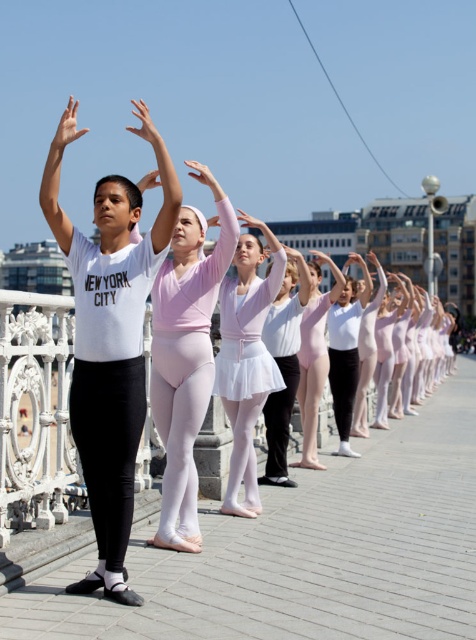
Which of these two, pink satin leotard at center or matte white shirt at upper left, stands shorter?

pink satin leotard at center is shorter.

Is the position of pink satin leotard at center more distant than that of matte white shirt at upper left?

Yes, pink satin leotard at center is behind matte white shirt at upper left.

The image size is (476, 640). I want to click on pink satin leotard at center, so click(186, 356).

Which of these two, white matte t-shirt at center or matte white shirt at upper left, stands shorter?

matte white shirt at upper left

In the scene shown: Can you confirm if white matte t-shirt at center is shorter than matte white shirt at upper left?

No, white matte t-shirt at center is not shorter than matte white shirt at upper left.

Does point (120, 436) come farther from viewer compared to point (71, 113)?

No, it is not.

This screenshot has width=476, height=640. In order to click on white matte t-shirt at center in this screenshot , I will do `click(109, 339)`.

Which is more to the left, matte white ballet skirt at center or matte pink leotard at center?

From the viewer's perspective, matte white ballet skirt at center appears more on the left side.

Who is taller, matte white ballet skirt at center or matte pink leotard at center?

With more height is matte pink leotard at center.

Measure the distance between matte white ballet skirt at center and camera.

The distance of matte white ballet skirt at center from camera is 10.95 meters.

Where is `matte white ballet skirt at center`? The height and width of the screenshot is (640, 476). matte white ballet skirt at center is located at coordinates (284, 364).